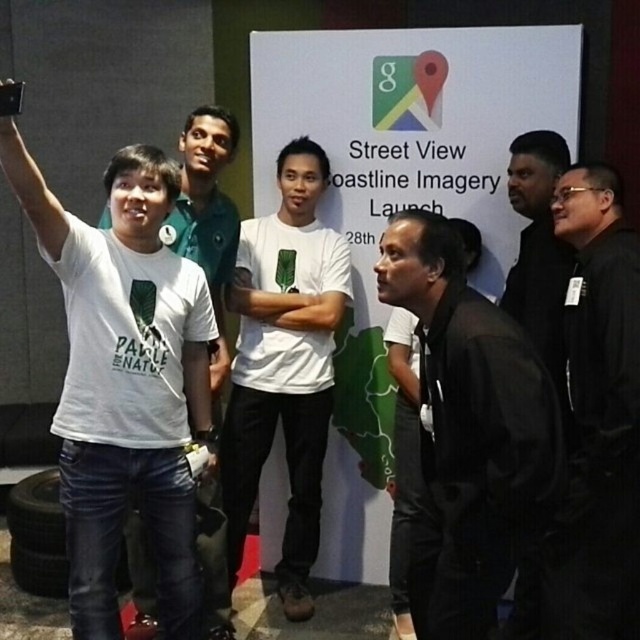
Question: Which of the following is the closest to the observer?

Choices:
 (A) white matte t-shirt at center
 (B) white cotton t-shirt at left
 (C) black matte jacket at right

Answer: (C)

Question: From the image, what is the correct spatial relationship of black leather jacket at center in relation to black matte jacket at right?

Choices:
 (A) right
 (B) left

Answer: (B)

Question: Is white matte t-shirt at center behind black matte jacket at right?

Choices:
 (A) no
 (B) yes

Answer: (B)

Question: Where is black leather jacket at center located in relation to white cotton t-shirt at left in the image?

Choices:
 (A) above
 (B) below

Answer: (B)

Question: Among these objects, which one is farthest from the camera?

Choices:
 (A) black matte jacket at right
 (B) white matte t-shirt at center

Answer: (B)

Question: Which of the following is the closest to the observer?

Choices:
 (A) (436, 550)
 (B) (216, 252)
 (C) (289, 448)

Answer: (A)